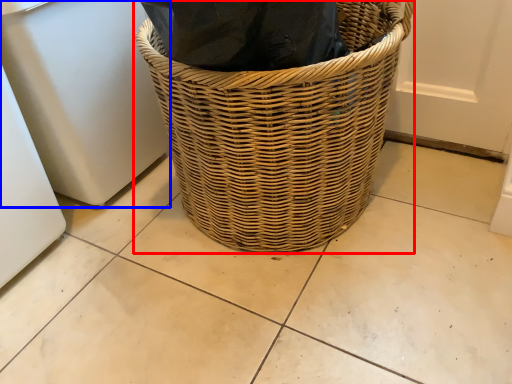
Question: Which point is closer to the camera, picnic basket (highlighted by a red box) or appliance (highlighted by a blue box)?

Choices:
 (A) picnic basket
 (B) appliance

Answer: (A)